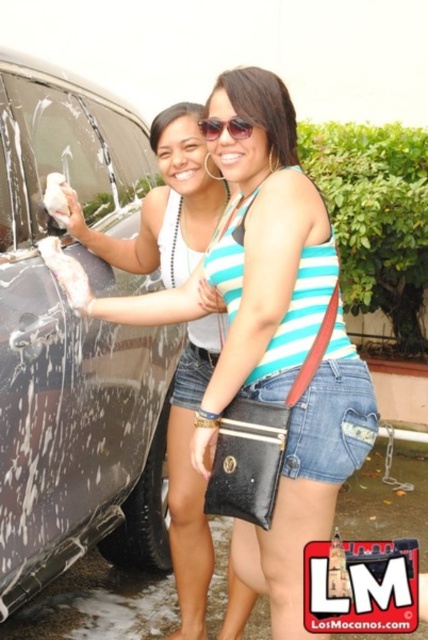
You are trying to determine which object is wider between the blue striped tank top at center and the sunglasses at upper center. Based on the scene, which one has a greater width?

The blue striped tank top at center is wider than the sunglasses at upper center.

In the scene shown: You are trying to decide where to place a new plant pot between the shiny metallic car at left and the blue striped tank top at center. Based on their widths, which object should you place the pot next to to ensure it fits better?

The blue striped tank top at center has a greater width than the shiny metallic car at left, so placing the plant pot next to the blue striped tank top at center would provide more space for the pot to fit comfortably.